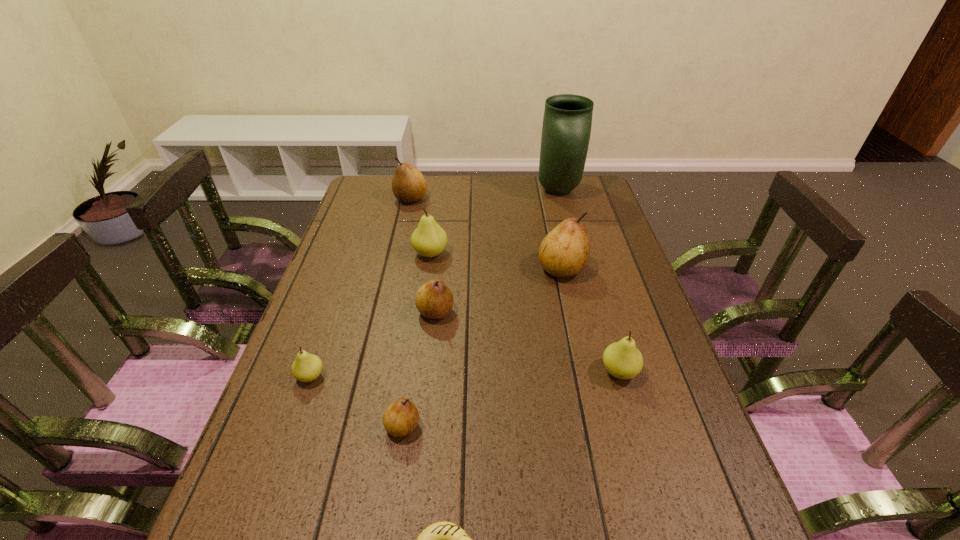
This screenshot has width=960, height=540. Find the location of `vacant space situated on the back of the rightmost green pear`. vacant space situated on the back of the rightmost green pear is located at coordinates (588, 263).

Locate an element on the screen. vacant space situated 0.150m on the back of the leftmost pear is located at coordinates (330, 319).

The image size is (960, 540). In order to click on vacant region located on the front of the nearest pear in this screenshot , I will do `click(394, 487)`.

The height and width of the screenshot is (540, 960). What are the coordinates of `vase situated at the far edge` in the screenshot? It's located at (567, 121).

Image resolution: width=960 pixels, height=540 pixels. What are the coordinates of `pear located at the far edge` in the screenshot? It's located at (409, 186).

This screenshot has width=960, height=540. What are the coordinates of `vase that is at the right edge` in the screenshot? It's located at (567, 121).

Where is `object that is positioned at the far left corner`? The image size is (960, 540). object that is positioned at the far left corner is located at coordinates (409, 186).

I want to click on object that is at the far right corner, so 567,121.

Identify the location of free spot at the far edge of the desktop. The image size is (960, 540). (555, 199).

This screenshot has width=960, height=540. In order to click on free point at the left edge in this screenshot , I will do `click(332, 375)`.